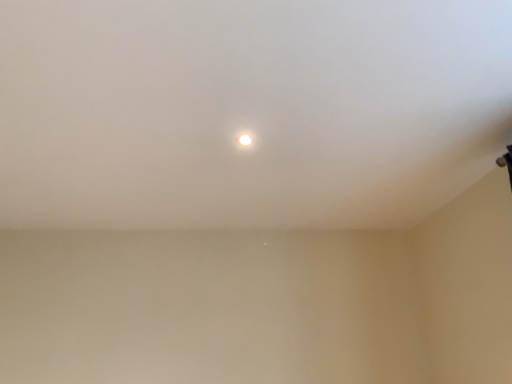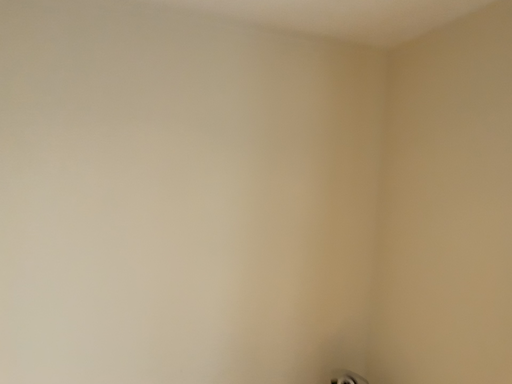
Question: How did the camera likely rotate when shooting the video?

Choices:
 (A) rotated upward
 (B) rotated downward

Answer: (B)